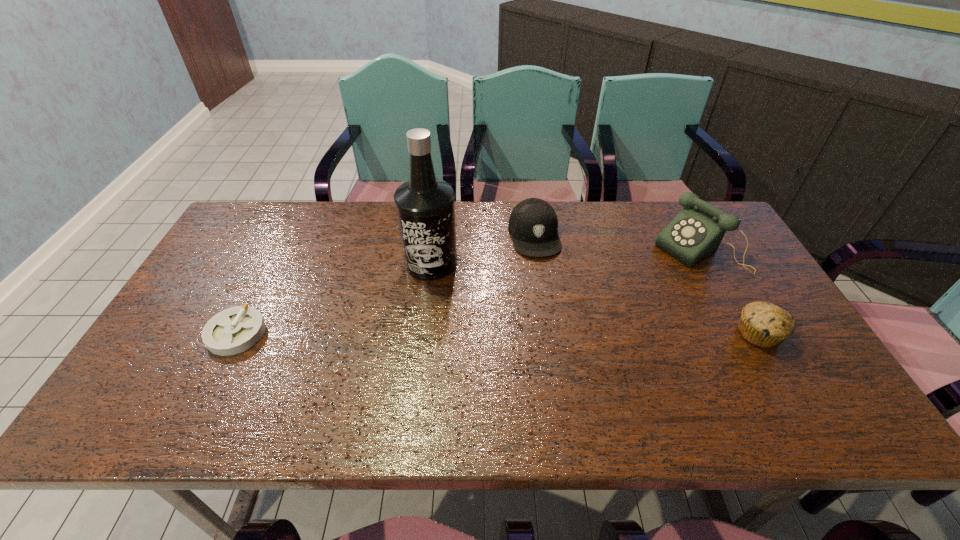
In order to click on free spot located 0.390m on the front-facing side of the cap in this screenshot , I will do tap(567, 370).

Find the location of `free space located 0.320m on the front-facing side of the cap`. free space located 0.320m on the front-facing side of the cap is located at coordinates (561, 346).

Find the location of a particular element. This screenshot has height=540, width=960. vacant space located 0.100m on the front label of the liquor is located at coordinates (430, 308).

Where is `blank space located on the front label of the liquor`? blank space located on the front label of the liquor is located at coordinates (430, 353).

This screenshot has height=540, width=960. I want to click on free point located on the front label of the liquor, so click(430, 353).

In order to click on vacant region located on the dial of the second tallest object in this screenshot , I will do `click(592, 309)`.

The image size is (960, 540). In order to click on vacant space situated on the dial of the second tallest object in this screenshot , I will do `click(655, 273)`.

The width and height of the screenshot is (960, 540). I want to click on vacant space situated on the dial of the second tallest object, so click(x=619, y=294).

At what (x,y) coordinates should I click in order to perform the action: click on cap that is at the far edge. Please return your answer as a coordinate pair (x, y). This screenshot has height=540, width=960. Looking at the image, I should click on (533, 223).

At what (x,y) coordinates should I click in order to perform the action: click on liquor that is at the far edge. Please return your answer as a coordinate pair (x, y). Looking at the image, I should click on (425, 206).